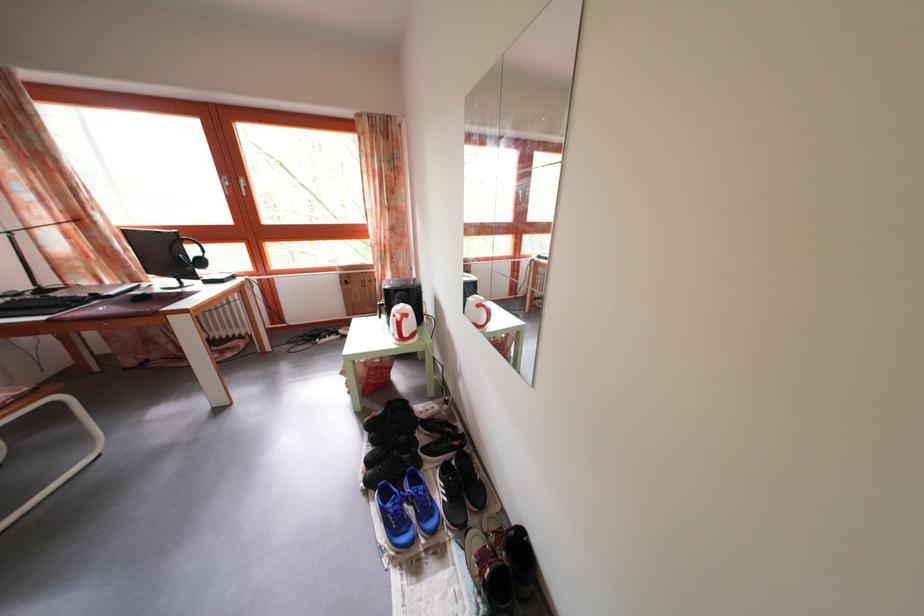
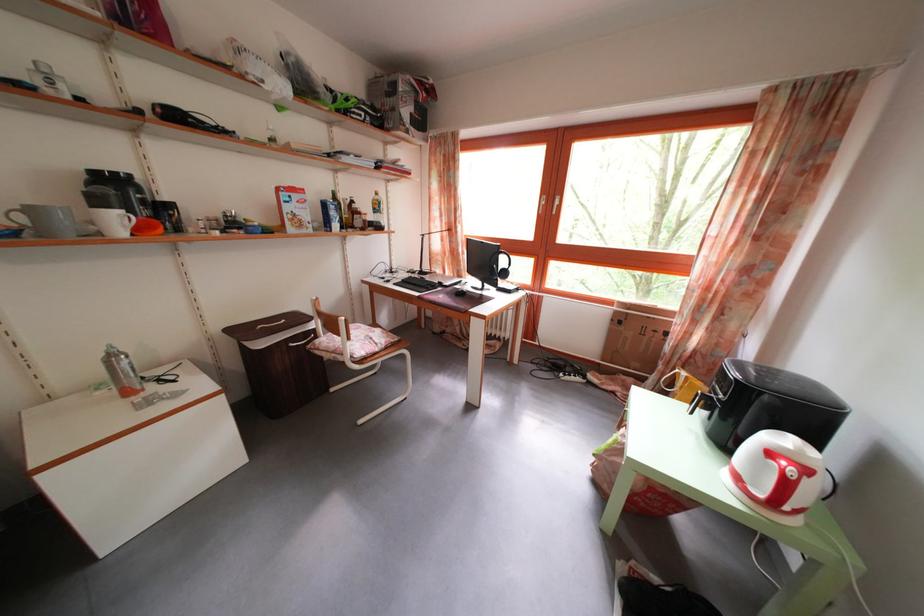
The point at (414, 323) is marked in the first image. Where is the corresponding point in the second image?

(812, 477)